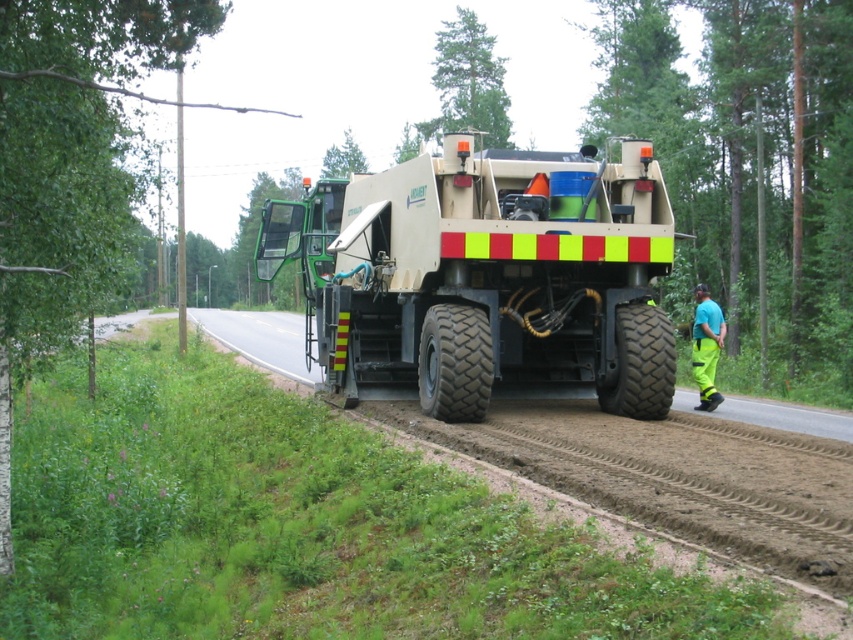
You are a delivery driver who needs to park your truck behind the beige rubber garbage truck at center. The parking space behind it can only accommodate vehicles shorter than the neon yellow reflective pants at right. Can your truck fit in the space?

The beige rubber garbage truck at center is taller than the neon yellow reflective pants at right. Since the parking space requires vehicles shorter than the neon yellow reflective pants at right, the beige rubber garbage truck at center is too tall to fit in the space. Therefore, your truck cannot park there.

You are a delivery driver who needs to park your truck on the side of the road in the forested area shown in the image. The beige rubber garbage truck at center is already parked there. Can you safely park your truck next to it without overlapping?

The beige rubber garbage truck at center is located at point [485,280]. Since you need to park next to it without overlapping, you should ensure there is enough space on the side of the road. However, the image does not provide information about the available space or the size of the truck. Therefore, it is uncertain if you can safely park next to it without overlapping.